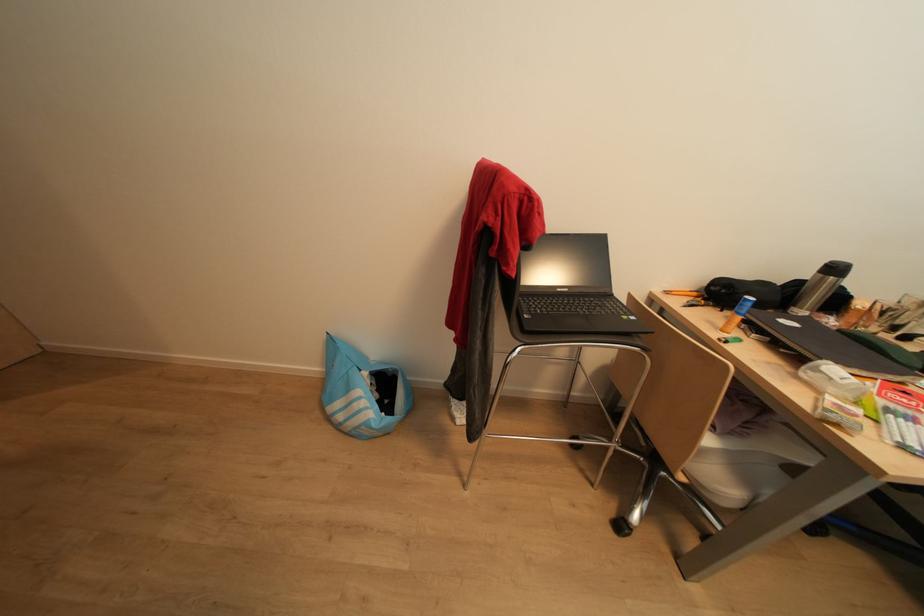
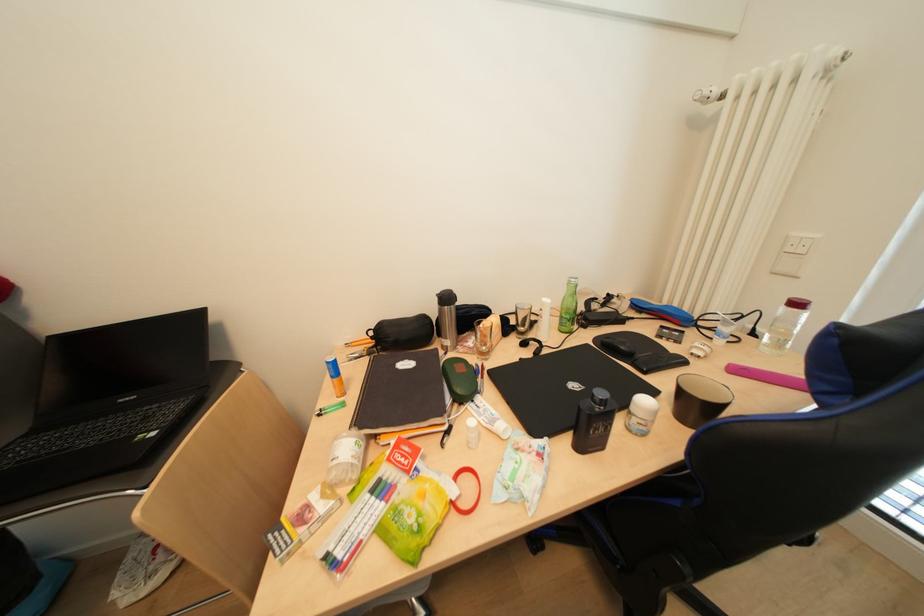
Question: Which direction would the cameraman need to move to produce the second image? Reply with the corresponding letter.

Choices:
 (A) Left
 (B) Right
 (C) Forward
 (D) Backward

Answer: (B)